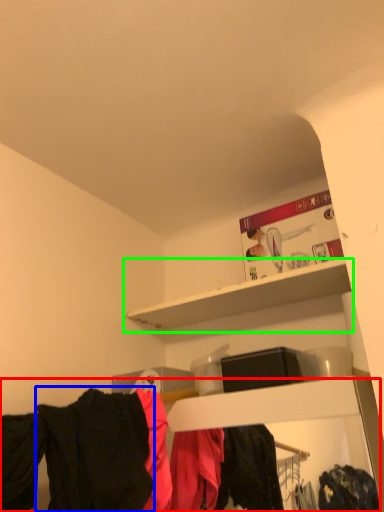
Question: Estimate the real-world distances between objects in this image. Which object is farther from closet (highlighted by a red box), clothing (highlighted by a blue box) or shelf (highlighted by a green box)?

Choices:
 (A) clothing
 (B) shelf

Answer: (B)